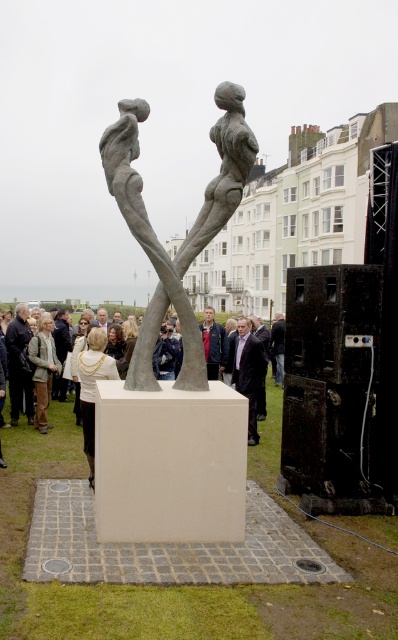
Does bronze sculpture at center have a lesser width compared to dark brown leather jacket at left?

No, bronze sculpture at center is not thinner than dark brown leather jacket at left.

Who is positioned more to the right, bronze sculpture at center or dark brown leather jacket at left?

From the viewer's perspective, bronze sculpture at center appears more on the right side.

Is point (216, 188) less distant than point (27, 321)?

Yes, point (216, 188) is in front of point (27, 321).

Identify the location of bronze sculpture at center. Image resolution: width=398 pixels, height=640 pixels. (189, 230).

Who is more forward, (212, 317) or (267, 337)?

Point (212, 317) is more forward.

Which of these two, leather jacket at center or dark suit at center, stands shorter?

leather jacket at center

Is point (218, 364) farther from camera compared to point (269, 349)?

No, it is not.

Locate an element on the screen. leather jacket at center is located at coordinates (212, 342).

Does dark suit at center appear on the right side of light brown leather jacket at center?

Indeed, dark suit at center is positioned on the right side of light brown leather jacket at center.

Does dark suit at center have a greater height compared to light brown leather jacket at center?

Correct, dark suit at center is much taller as light brown leather jacket at center.

Measure the distance between dark suit at center and camera.

The distance of dark suit at center from camera is 15.94 meters.

The height and width of the screenshot is (640, 398). Identify the location of dark suit at center. (261, 333).